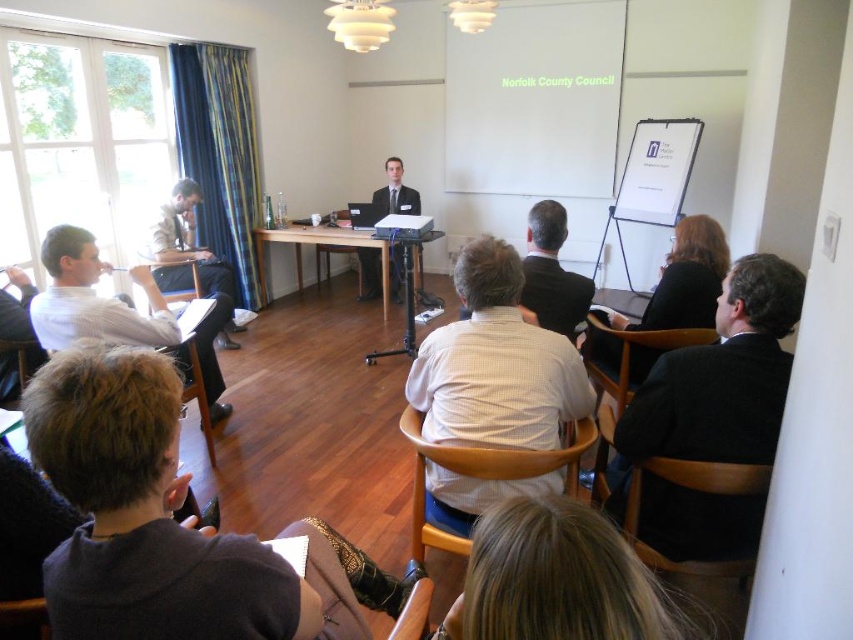
Find the location of a particular element. light brown leather jacket at left is located at coordinates [x=189, y=256].

From the picture: Does light brown leather jacket at left have a lesser height compared to light brown wood table at center?

No.

Is point (190, 250) positioned in front of point (381, 273)?

Yes, it is in front of point (381, 273).

This screenshot has height=640, width=853. Find the location of `light brown leather jacket at left`. light brown leather jacket at left is located at coordinates (189, 256).

Which of these two, black suit at right or white shirt at left, stands taller?

With more height is white shirt at left.

Who is shorter, black suit at right or white shirt at left?

With less height is black suit at right.

Is point (660, 484) less distant than point (51, 236)?

Yes, it is in front of point (51, 236).

This screenshot has width=853, height=640. I want to click on black suit at right, so click(x=717, y=381).

Is white checkered shirt at center wider than light brown wood table at center?

In fact, white checkered shirt at center might be narrower than light brown wood table at center.

Is white checkered shirt at center below light brown wood table at center?

Yes.

Is point (490, 336) less distant than point (260, 280)?

Yes, point (490, 336) is closer to viewer.

Where is `white checkered shirt at center`? Image resolution: width=853 pixels, height=640 pixels. white checkered shirt at center is located at coordinates (496, 364).